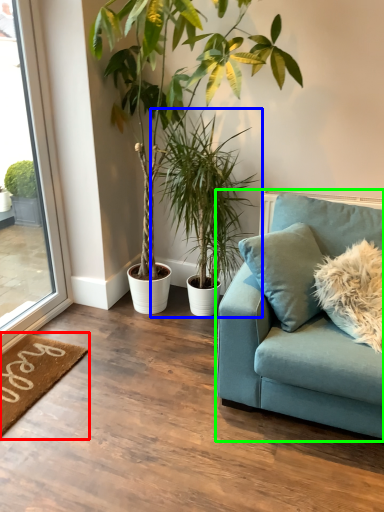
Question: Which is nearer to the doormat (highlighted by a red box)? houseplant (highlighted by a blue box) or studio couch (highlighted by a green box).

Choices:
 (A) houseplant
 (B) studio couch

Answer: (B)